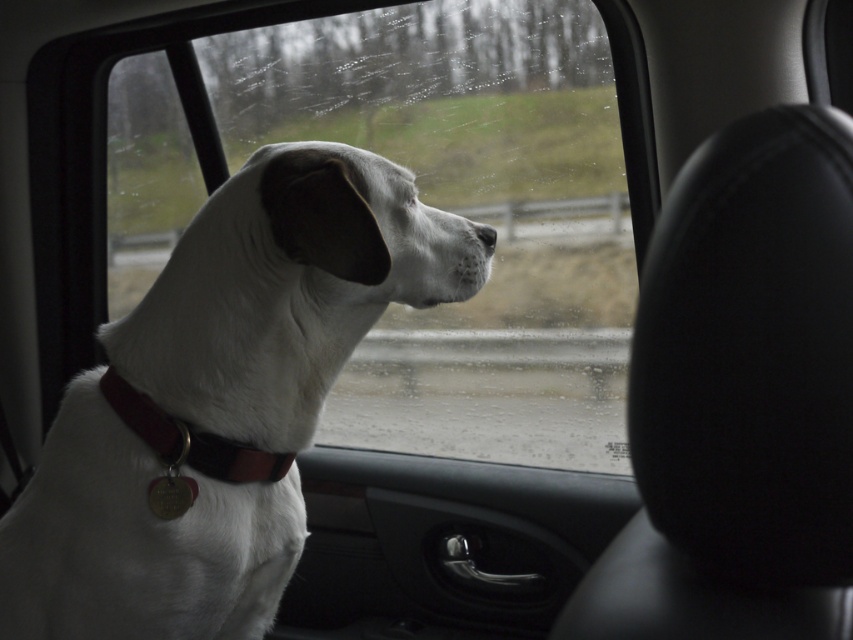
What do you see at coordinates (287, 289) in the screenshot? The width and height of the screenshot is (853, 640). I see `white matte dog at center` at bounding box center [287, 289].

Is point (320, 387) positioned after point (335, 275)?

Yes, it is behind point (335, 275).

Locate an element on the screen. The height and width of the screenshot is (640, 853). white matte dog at center is located at coordinates (287, 289).

This screenshot has height=640, width=853. In order to click on white matte dog at center in this screenshot , I will do `click(287, 289)`.

The image size is (853, 640). I want to click on white matte dog at center, so click(x=287, y=289).

Locate an element on the screen. brown leather collar at center is located at coordinates (189, 438).

Between brown leather collar at center and black matte nose at center, which one has less height?

With less height is black matte nose at center.

Where is `brown leather collar at center`? The width and height of the screenshot is (853, 640). brown leather collar at center is located at coordinates (189, 438).

At what (x,y) coordinates should I click in order to perform the action: click on brown leather collar at center. Please return your answer as a coordinate pair (x, y). The width and height of the screenshot is (853, 640). Looking at the image, I should click on (189, 438).